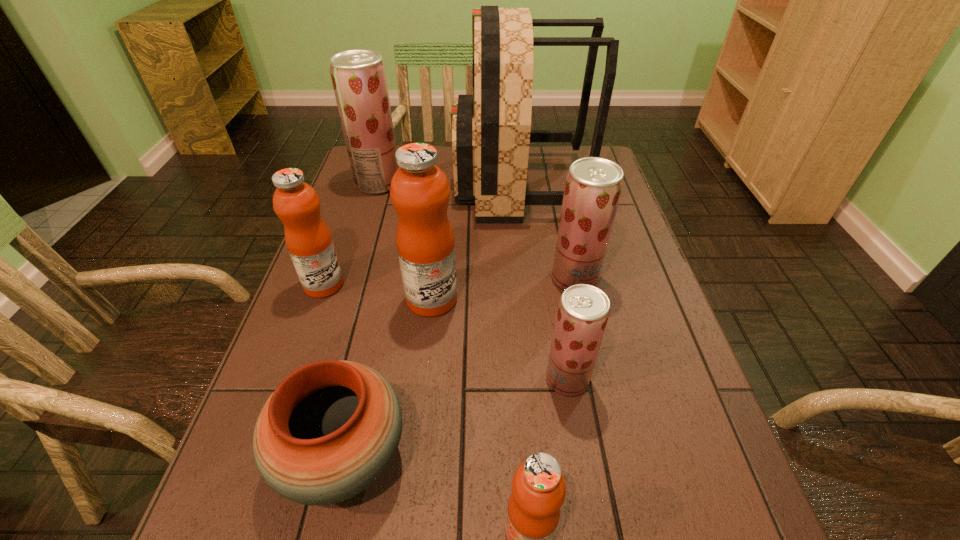
Locate which orange fruit juice ranks in proximity to the third fruit juice from left to right. Please provide its 2D coordinates. Your answer should be formatted as a tuple, i.e. [(x, y)], where the tuple contains the x and y coordinates of a point satisfying the conditions above.

[(308, 239)]

You are a GUI agent. You are given a task and a screenshot of the screen. Output one action in this format:
    pyautogui.click(x=<x>, y=<y>)
    Task: Click on the orange fruit juice that is the closest one to the nearest orange fruit juice
    The height and width of the screenshot is (540, 960).
    Given the screenshot: What is the action you would take?
    pyautogui.click(x=420, y=192)

I want to click on vacant space that satisfies the following two spatial constraints: 1. on the front label of the leftmost orange fruit juice; 2. on the right side of the red pottery, so click(x=262, y=456).

At what (x,y) coordinates should I click in order to perform the action: click on free location that satisfies the following two spatial constraints: 1. on the front label of the smallest strawberry fruit juice; 2. on the left side of the biggest orange fruit juice. Please return your answer as a coordinate pair (x, y). Image resolution: width=960 pixels, height=540 pixels. Looking at the image, I should click on (423, 379).